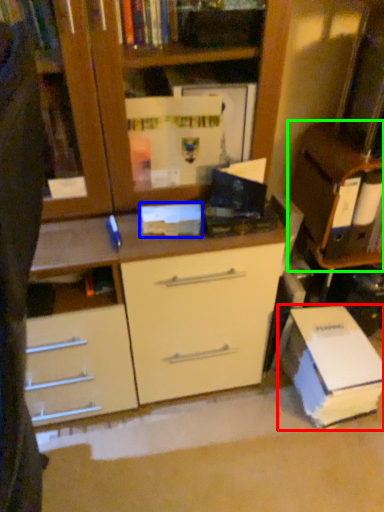
Question: Which object is the closest to the paperback book (highlighted by a red box)? Choose among these: paperback book (highlighted by a blue box) or cabinetry (highlighted by a green box).

Choices:
 (A) paperback book
 (B) cabinetry

Answer: (B)